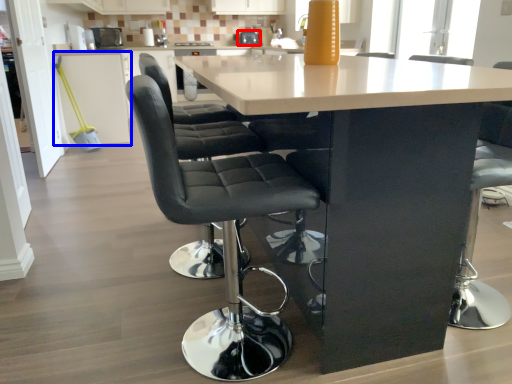
Question: Which point is further to the camera, appliance (highlighted by a red box) or cabinetry (highlighted by a blue box)?

Choices:
 (A) appliance
 (B) cabinetry

Answer: (A)